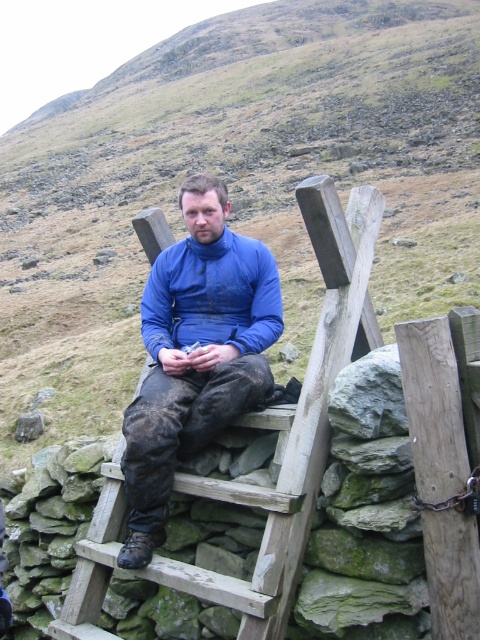
Measure the distance from wooden at center to blue fleece at center.

wooden at center is 23.85 inches from blue fleece at center.

Who is lower down, wooden at center or blue fleece at center?

Positioned lower is blue fleece at center.

Does point (265, 426) come in front of point (167, 340)?

Yes, point (265, 426) is closer to viewer.

Locate an element on the screen. This screenshot has height=640, width=480. wooden at center is located at coordinates (295, 420).